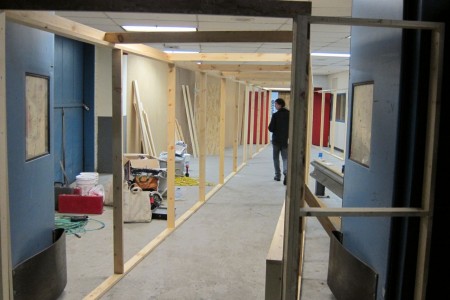
Find the location of a particular element. The image size is (450, 300). wall stud is located at coordinates (115, 169), (171, 143), (206, 136), (225, 134), (242, 126).